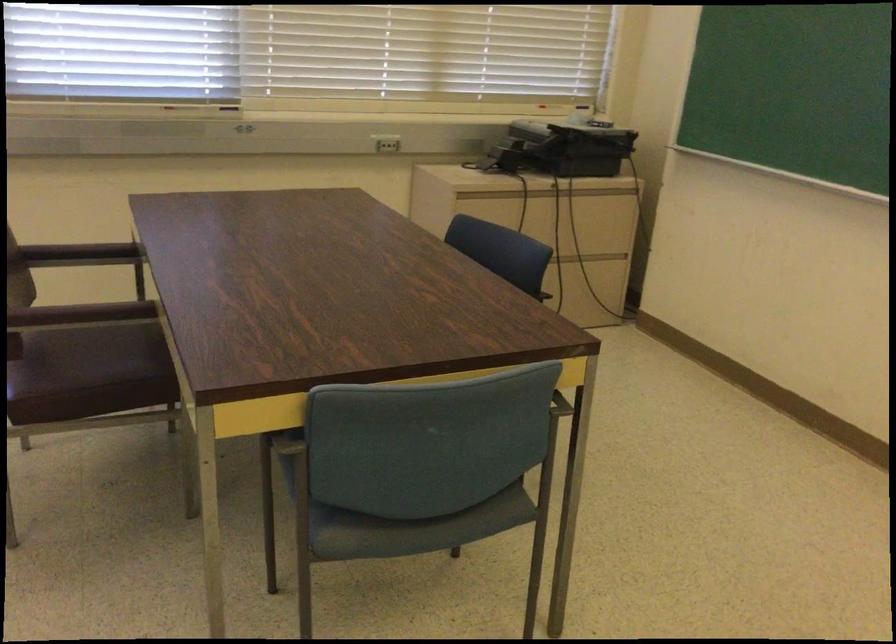
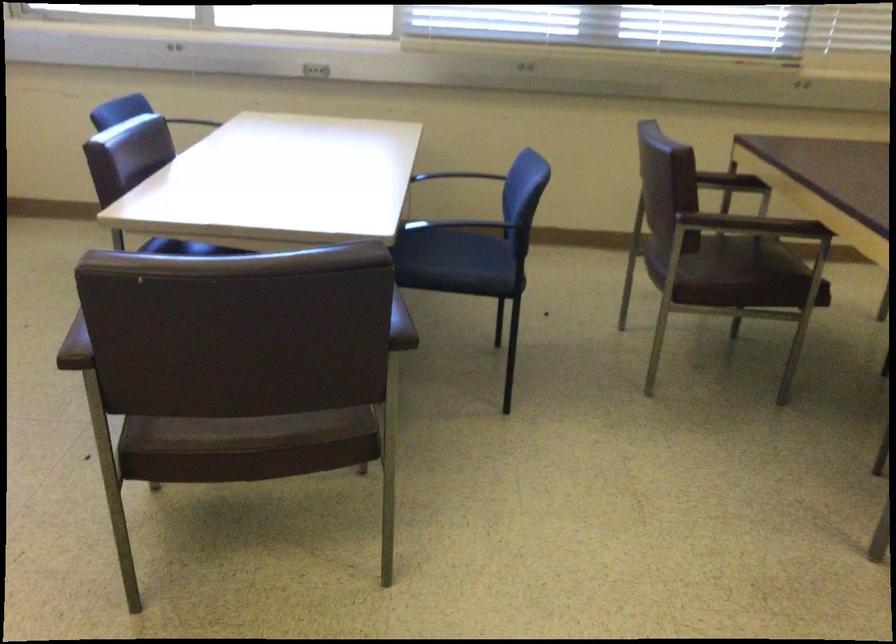
In the second image, find the point that corresponds to point 101,382 in the first image.

(739, 278)